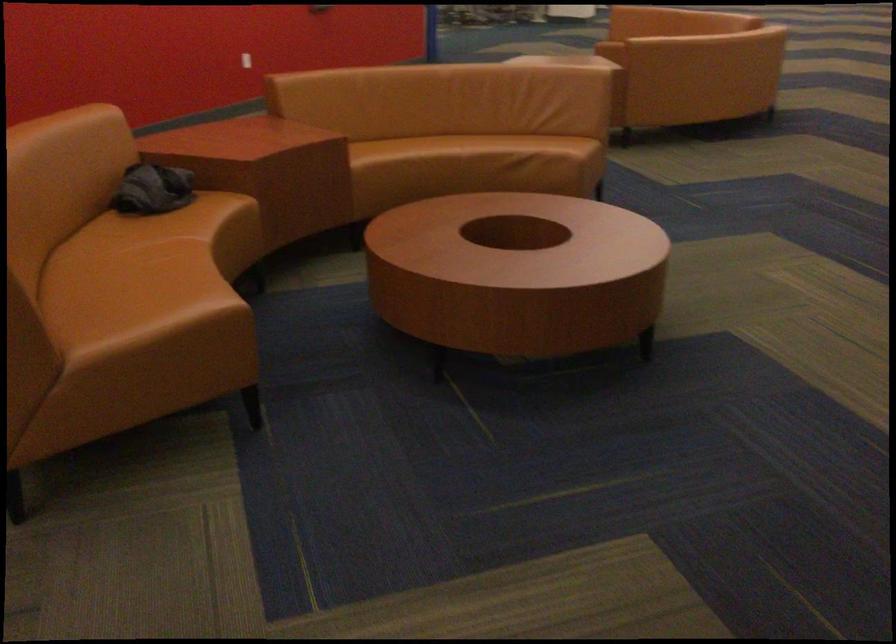
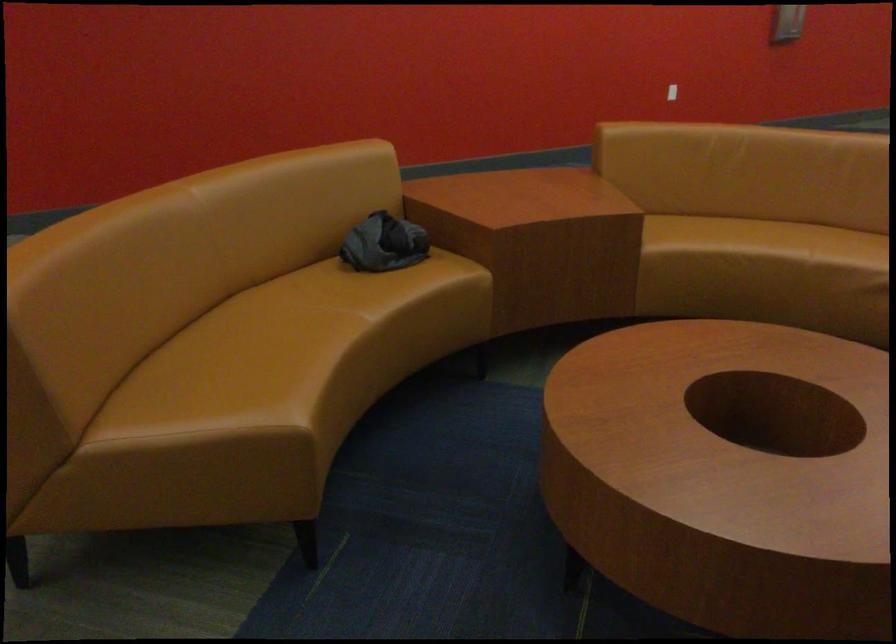
The point at (400, 156) is marked in the first image. Where is the corresponding point in the second image?

(719, 242)